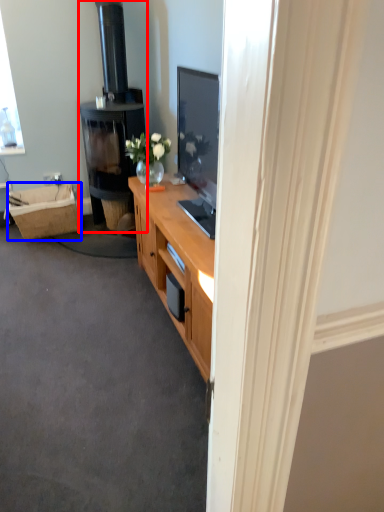
Question: Among these objects, which one is nearest to the camera, fireplace (highlighted by a red box) or picnic basket (highlighted by a blue box)?

Choices:
 (A) fireplace
 (B) picnic basket

Answer: (A)